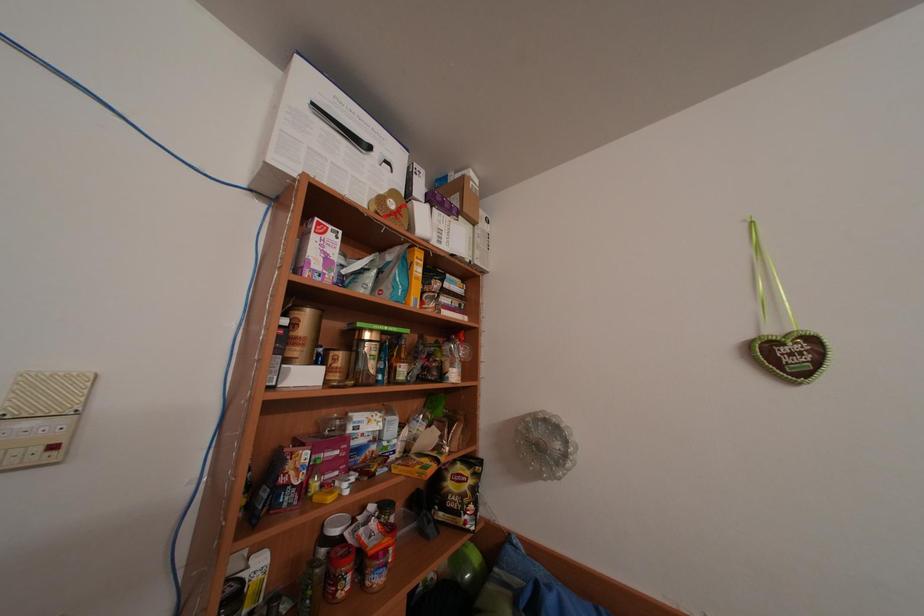
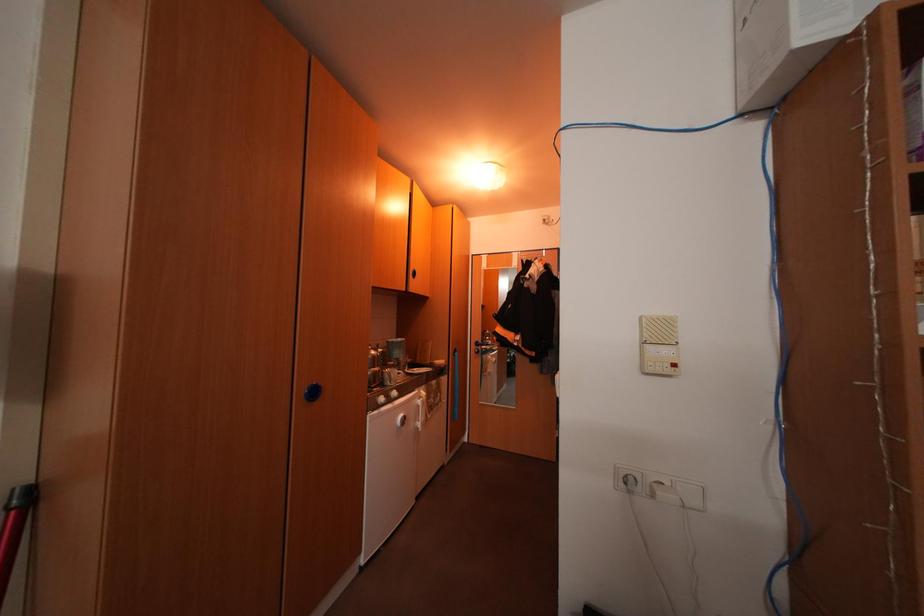
Question: The first image is from the beginning of the video and the second image is from the end. How did the camera likely rotate when shooting the video?

Choices:
 (A) Left
 (B) Right
 (C) Up
 (D) Down

Answer: (A)